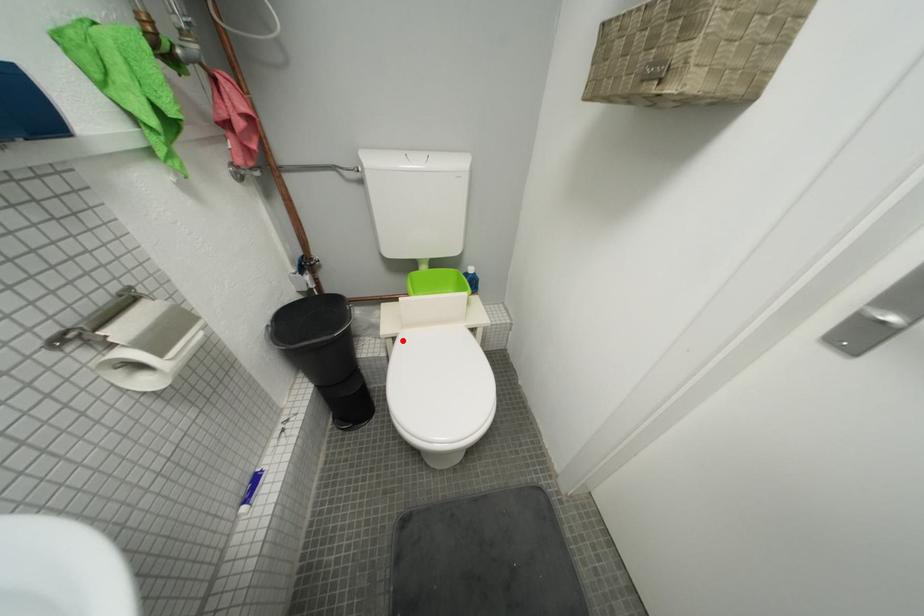
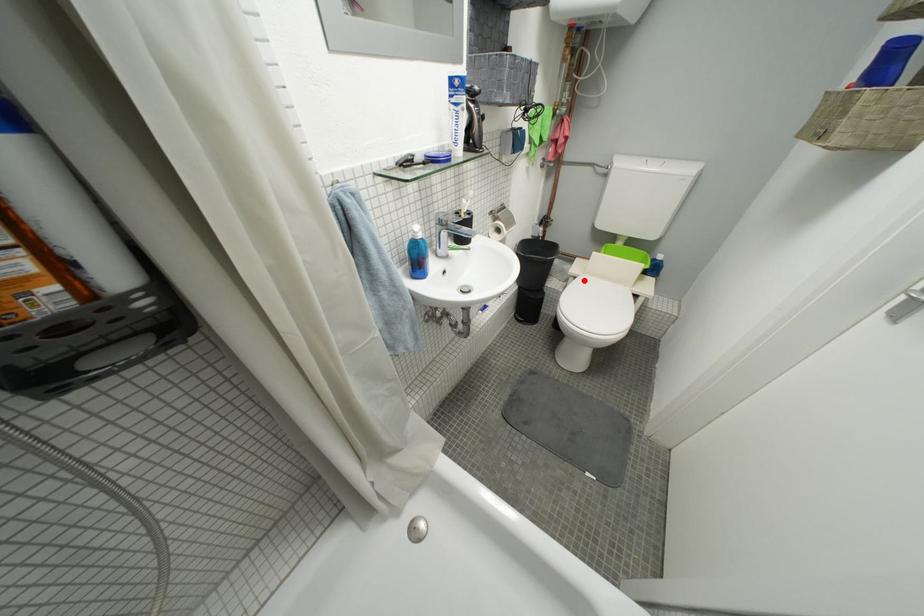
I am providing you with two images of the same scene from different viewpoints. A red point is marked on the first image and another point is marked on the second image. Does the point marked in image1 correspond to the same location as the one in image2?

Yes